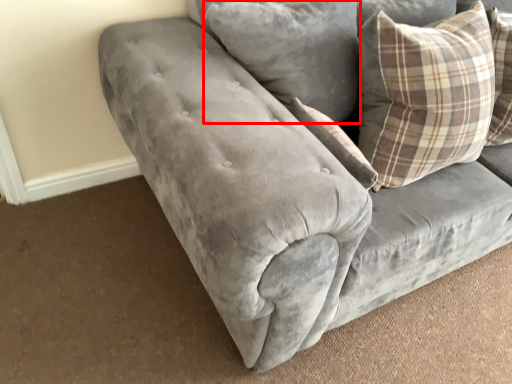
Question: Observing the image, what is the correct spatial positioning of pillow (annotated by the red box) in reference to pillow?

Choices:
 (A) left
 (B) right

Answer: (A)